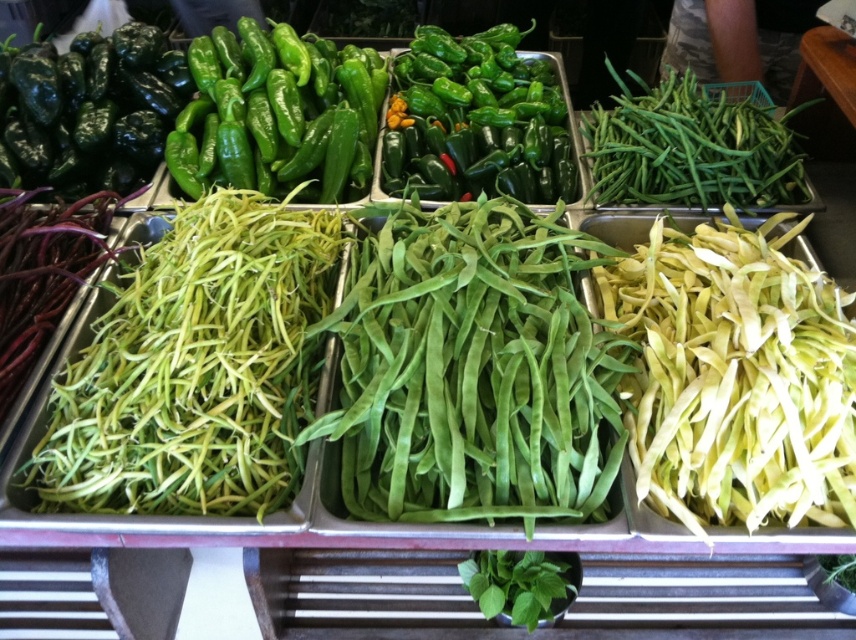
You are a customer at the market stall and want to locate the green glossy peppers at upper center. According to the coordinates provided, where exactly are they positioned?

The green glossy peppers at upper center are positioned at coordinates point (277,113).

You are at the market stall and want to find the glossy dark green pepper at upper left. According to the coordinates provided, where should you look relative to the other vegetables?

The glossy dark green pepper at upper left is located at point (88,109), which means it is positioned in the top left section of the market stall, to the left of the bright green chili peppers and the smaller elongated green peppers.

You are a customer at the market stall looking at the glossy dark green pepper at upper left and the green leafy at bottom. Which one is closer to you?

The glossy dark green pepper at upper left is closer to you because the green leafy at bottom is behind it.